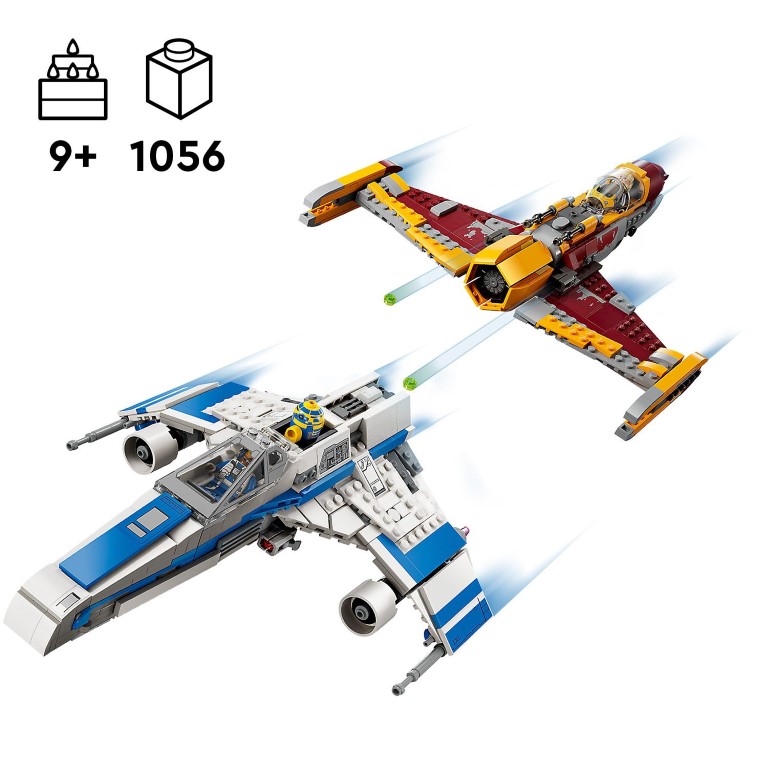
Locate an element on the screen. This screenshot has width=768, height=768. boxes rectangular is located at coordinates (94, 100), (84, 54).